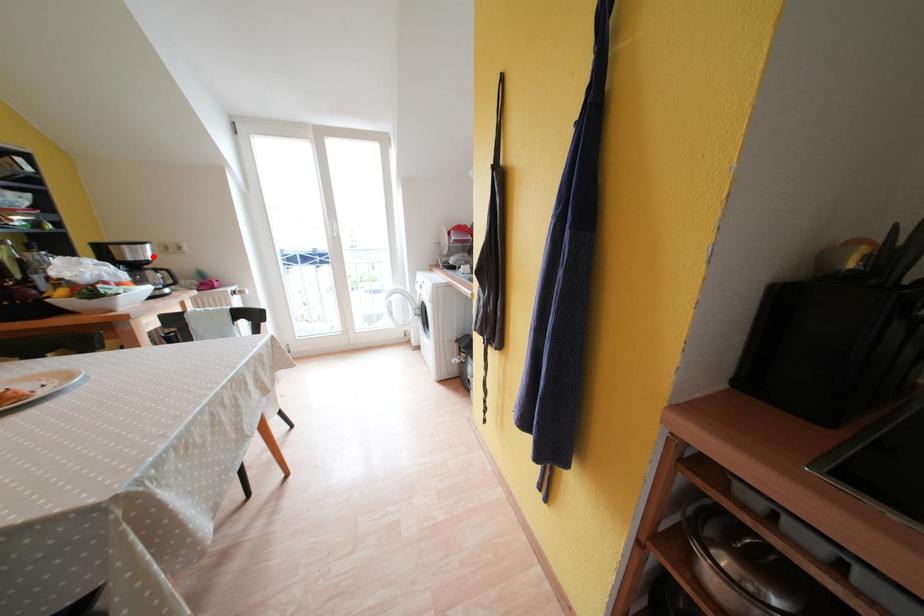
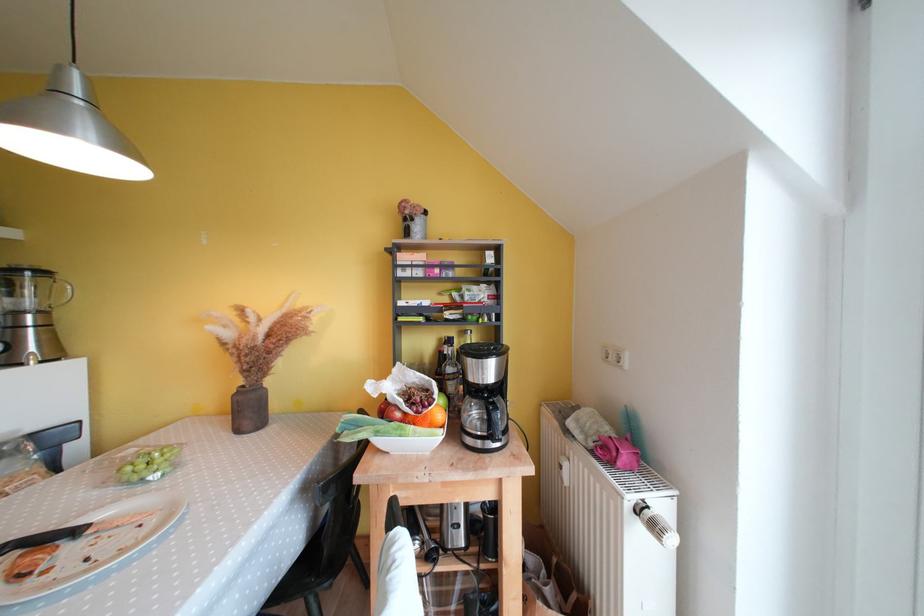
Locate, in the second image, the point that corresponds to the highlighted location in the first image.

(494, 376)